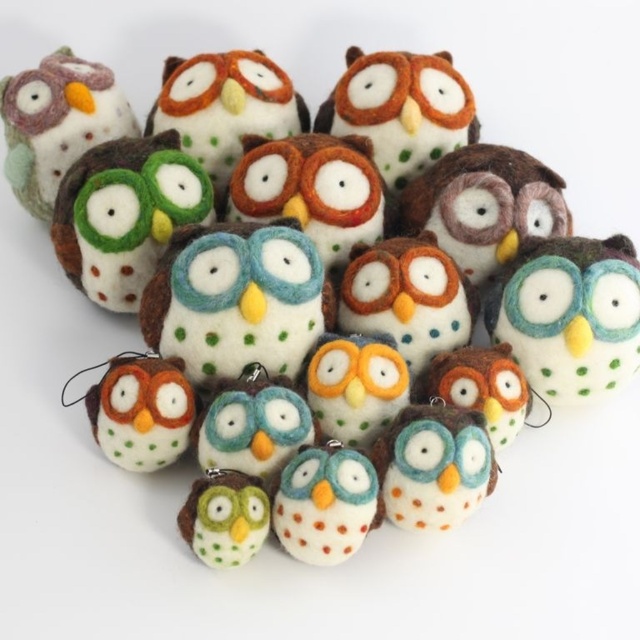
Question: Among these points, which one is farthest from the camera?

Choices:
 (A) (38, 122)
 (B) (556, 342)

Answer: (A)

Question: Which point is farther to the camera?

Choices:
 (A) (76, 120)
 (B) (628, 310)

Answer: (A)

Question: Is matte felt owl at center thinner than matte felt owl at upper left?

Choices:
 (A) yes
 (B) no

Answer: (B)

Question: Can you confirm if matte felt owl at center is positioned to the left of matte felt owl at upper left?

Choices:
 (A) no
 (B) yes

Answer: (A)

Question: Can you confirm if matte felt owl at center is thinner than matte felt owl at upper left?

Choices:
 (A) yes
 (B) no

Answer: (B)

Question: Which point is farther to the camera?

Choices:
 (A) matte felt owl at upper left
 (B) matte felt owl at center

Answer: (A)